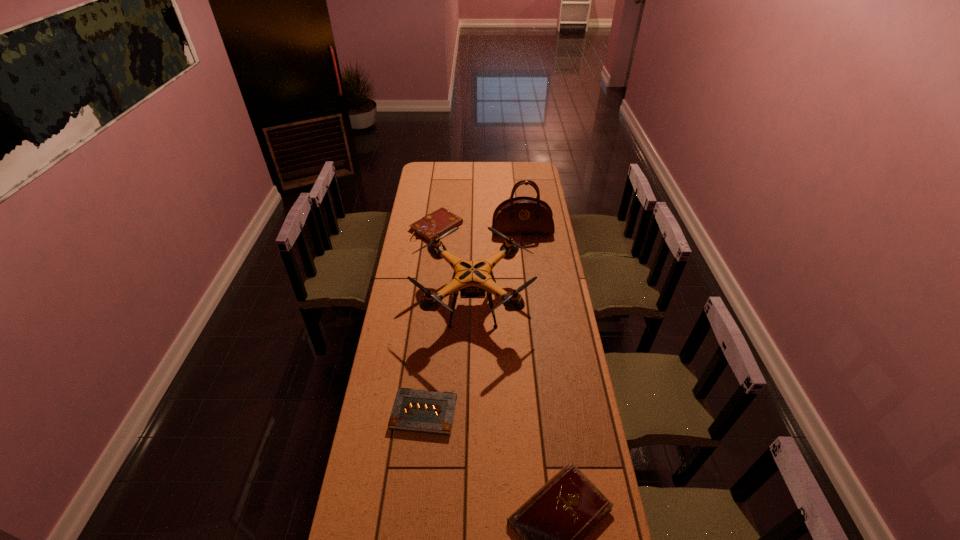
Identify the location of drone at the left edge. Image resolution: width=960 pixels, height=540 pixels. pyautogui.click(x=472, y=278).

In order to click on object at the right edge in this screenshot , I will do `click(521, 215)`.

The width and height of the screenshot is (960, 540). In the image, there is a desktop. Find the location of `vacant region at the far edge`. vacant region at the far edge is located at coordinates (516, 178).

This screenshot has width=960, height=540. In order to click on free space at the left edge of the desktop in this screenshot , I will do `click(406, 374)`.

This screenshot has height=540, width=960. I want to click on free space at the right edge of the desktop, so click(x=541, y=255).

The height and width of the screenshot is (540, 960). What are the coordinates of `empty location between the second nearest notebook and the handbag` in the screenshot? It's located at pyautogui.click(x=473, y=322).

At what (x,y) coordinates should I click in order to perform the action: click on vacant space in between the third nearest object and the second nearest notebook. Please return your answer as a coordinate pair (x, y). Image resolution: width=960 pixels, height=540 pixels. Looking at the image, I should click on (448, 358).

Find the location of a particular element. Image resolution: width=960 pixels, height=540 pixels. free spot between the second nearest object and the third tallest object is located at coordinates (430, 320).

Locate an element on the screen. This screenshot has width=960, height=540. vacant space in between the third nearest object and the handbag is located at coordinates (498, 267).

What are the coordinates of `free space between the farthest notebook and the second nearest notebook` in the screenshot? It's located at (430, 320).